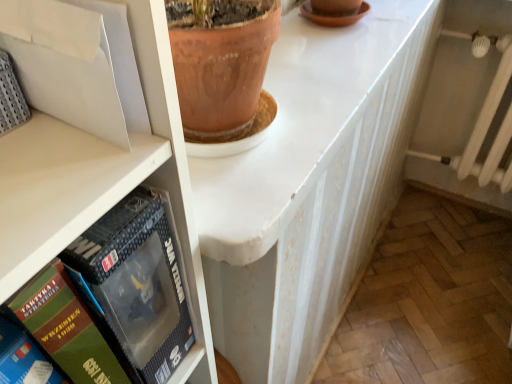
Question: From the image's perspective, is matte black box at left, the first book viewed from the right, located beneath white glossy counter top at center?

Choices:
 (A) yes
 (B) no

Answer: (A)

Question: From a real-world perspective, is matte black box at left, the first book viewed from the right, over white glossy counter top at center?

Choices:
 (A) no
 (B) yes

Answer: (A)

Question: Would you say matte black box at left, which is the 3th book in left-to-right order, contains white glossy counter top at center?

Choices:
 (A) no
 (B) yes

Answer: (A)

Question: Could you tell me if matte black box at left, the first book viewed from the right, is turned towards white glossy counter top at center?

Choices:
 (A) yes
 (B) no

Answer: (B)

Question: Is matte black box at left, which is the 3th book in left-to-right order, oriented away from white glossy counter top at center?

Choices:
 (A) no
 (B) yes

Answer: (A)

Question: Can you confirm if matte black box at left, the first book viewed from the right, is smaller than white glossy counter top at center?

Choices:
 (A) no
 (B) yes

Answer: (B)

Question: From the image's perspective, is green cardboard book at lower left, marked as the third book in a right-to-left arrangement, on green matte book at left, arranged as the 2th book when viewed from the left?

Choices:
 (A) no
 (B) yes

Answer: (B)

Question: From a real-world perspective, does green cardboard book at lower left, marked as the third book in a right-to-left arrangement, sit lower than green matte book at left, the second book when ordered from right to left?

Choices:
 (A) no
 (B) yes

Answer: (A)

Question: Considering the relative sizes of green cardboard book at lower left, marked as the third book in a right-to-left arrangement, and green matte book at left, arranged as the 2th book when viewed from the left, in the image provided, is green cardboard book at lower left, marked as the third book in a right-to-left arrangement, smaller than green matte book at left, arranged as the 2th book when viewed from the left,?

Choices:
 (A) yes
 (B) no

Answer: (A)

Question: Can you confirm if green cardboard book at lower left, the 1th book from the left, is wider than green matte book at left, the second book when ordered from right to left?

Choices:
 (A) yes
 (B) no

Answer: (B)

Question: Does green cardboard book at lower left, marked as the third book in a right-to-left arrangement, have a greater height compared to green matte book at left, arranged as the 2th book when viewed from the left?

Choices:
 (A) yes
 (B) no

Answer: (B)

Question: Is green cardboard book at lower left, the 1th book from the left, directly adjacent to green matte book at left, arranged as the 2th book when viewed from the left?

Choices:
 (A) no
 (B) yes

Answer: (B)

Question: From the image's perspective, is white glossy counter top at center above green matte book at left, arranged as the 2th book when viewed from the left?

Choices:
 (A) yes
 (B) no

Answer: (A)